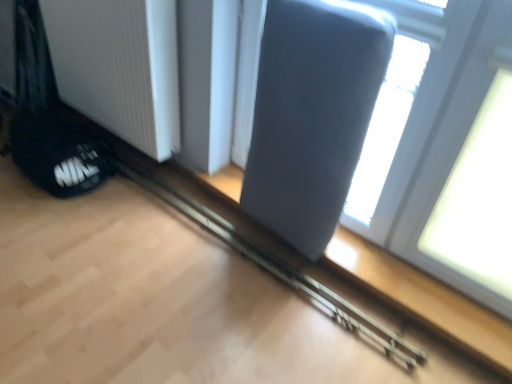
Question: Should I look upward or downward to see metallic gray rail at center?

Choices:
 (A) down
 (B) up

Answer: (A)

Question: From the image's perspective, is metallic gray rail at center over suede gray swivel chair at upper right?

Choices:
 (A) yes
 (B) no

Answer: (B)

Question: Is metallic gray rail at center outside of suede gray swivel chair at upper right?

Choices:
 (A) no
 (B) yes

Answer: (B)

Question: Is the position of metallic gray rail at center less distant than that of suede gray swivel chair at upper right?

Choices:
 (A) no
 (B) yes

Answer: (A)

Question: Is suede gray swivel chair at upper right at the back of metallic gray rail at center?

Choices:
 (A) yes
 (B) no

Answer: (B)

Question: Is suede gray swivel chair at upper right inside metallic gray rail at center?

Choices:
 (A) yes
 (B) no

Answer: (B)

Question: Does metallic gray rail at center have a smaller size compared to suede gray swivel chair at upper right?

Choices:
 (A) yes
 (B) no

Answer: (A)

Question: Considering the relative positions of white ribbed radiator at lower left and suede gray swivel chair at upper right in the image provided, is white ribbed radiator at lower left in front of suede gray swivel chair at upper right?

Choices:
 (A) yes
 (B) no

Answer: (B)

Question: Is white ribbed radiator at lower left beside suede gray swivel chair at upper right?

Choices:
 (A) yes
 (B) no

Answer: (B)

Question: Can you confirm if white ribbed radiator at lower left is bigger than suede gray swivel chair at upper right?

Choices:
 (A) yes
 (B) no

Answer: (A)

Question: Is white ribbed radiator at lower left thinner than suede gray swivel chair at upper right?

Choices:
 (A) yes
 (B) no

Answer: (A)

Question: Is white ribbed radiator at lower left facing away from suede gray swivel chair at upper right?

Choices:
 (A) no
 (B) yes

Answer: (A)

Question: From a real-world perspective, is white ribbed radiator at lower left on top of suede gray swivel chair at upper right?

Choices:
 (A) no
 (B) yes

Answer: (A)

Question: Is metallic gray rail at center aimed at white ribbed radiator at lower left?

Choices:
 (A) no
 (B) yes

Answer: (A)